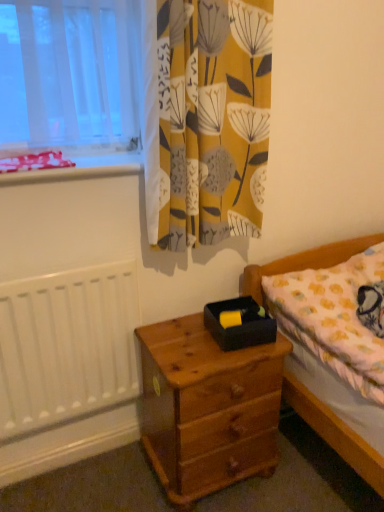
Where is `vacant location below white painted radiator at left (from a real-world perspective)`? Image resolution: width=384 pixels, height=512 pixels. vacant location below white painted radiator at left (from a real-world perspective) is located at coordinates (72, 460).